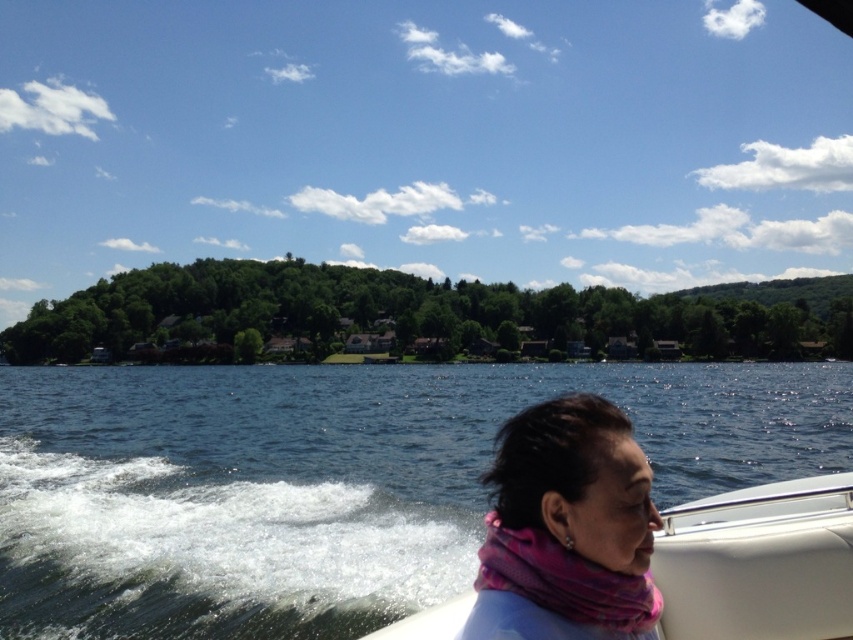
Based on the photo, you are a photographer trying to capture the pink fabric scarf at lower right and the blue water at lower left in a single frame. Which object will occupy more space in your photo?

The blue water at lower left is larger in size than the pink fabric scarf at lower right, so it will occupy more space in the photo.

You are standing on the lakeside and see the pink fabric scarf at lower right and the white matte boat at center. If you want to pick up the scarf first before approaching the boat, which direction should you move towards from your current position?

Since the pink fabric scarf at lower right is to the left of the white matte boat at center, you should move towards the left direction first to reach the scarf before going to the boat.

You are standing on the lakeside and want to take a photo of the white matte boat at center and the blue water at lower left. Which object will appear closer to the camera in your photo?

The blue water at lower left will appear closer to the camera because the white matte boat at center is behind it.